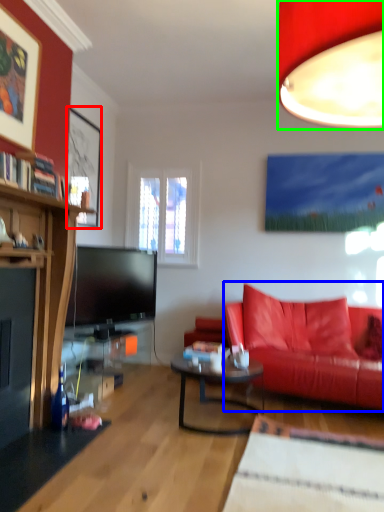
Question: Which is nearer to the picture frame (highlighted by a red box)? studio couch (highlighted by a blue box) or lamp (highlighted by a green box).

Choices:
 (A) studio couch
 (B) lamp

Answer: (A)